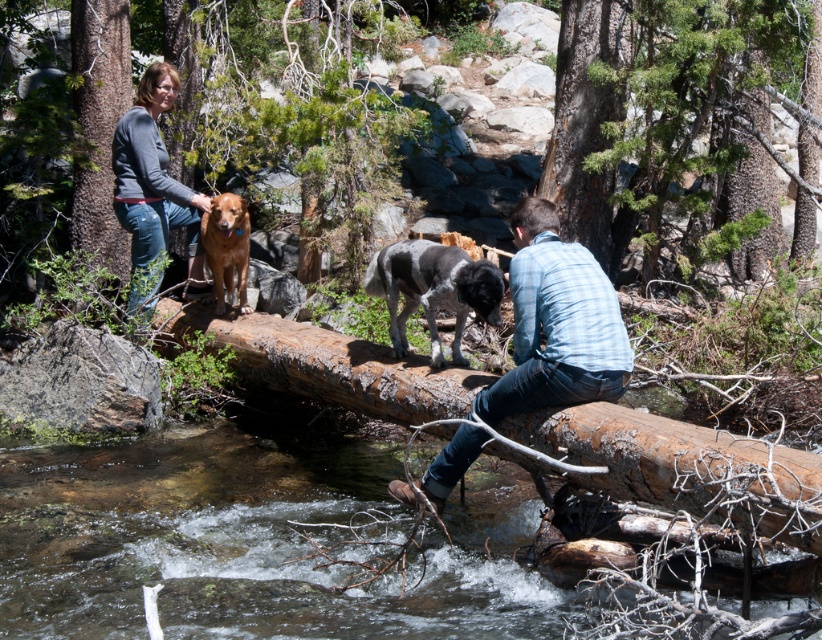
The width and height of the screenshot is (822, 640). What do you see at coordinates (682, 465) in the screenshot? I see `brown rough log at center` at bounding box center [682, 465].

Between brown rough log at center and gray and white fur dog at center, which one is positioned lower?

brown rough log at center is lower down.

Locate an element on the screen. This screenshot has width=822, height=640. brown rough log at center is located at coordinates (682, 465).

Can you confirm if matte gray sweater at upper left is positioned above gray and white fur dog at center?

Yes.

Who is more distant from viewer, (151, 104) or (393, 304)?

Point (151, 104)

Is point (137, 148) more distant than point (430, 291)?

Yes.

Where is `matte gray sweater at upper left`? Image resolution: width=822 pixels, height=640 pixels. matte gray sweater at upper left is located at coordinates (151, 188).

Does point (765, 477) come closer to viewer compared to point (557, 138)?

Yes, point (765, 477) is closer to viewer.

Which is in front, point (252, 324) or point (691, 115)?

Point (252, 324) is more forward.

This screenshot has width=822, height=640. Identify the location of brown rough log at center. (682, 465).

The image size is (822, 640). Find the location of `brown rough log at center`. brown rough log at center is located at coordinates (682, 465).